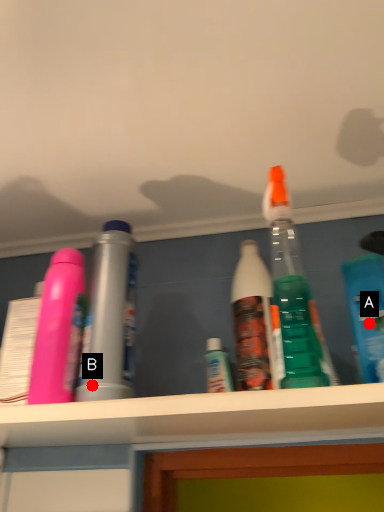
Question: Two points are circled on the image, labeled by A and B beside each circle. Which point is farther from the camera taking this photo?

Choices:
 (A) A is further
 (B) B is further

Answer: (A)